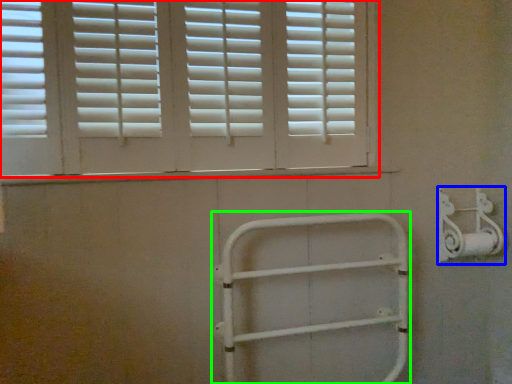
Question: Estimate the real-world distances between objects in this image. Which object is closer to window (highlighted by a red box), metal (highlighted by a blue box) or rail (highlighted by a green box)?

Choices:
 (A) metal
 (B) rail

Answer: (B)